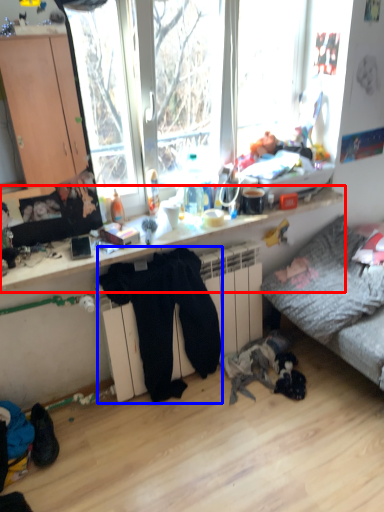
Question: Which of the following is the closest to the observer, desk (highlighted by a red box) or clothing (highlighted by a blue box)?

Choices:
 (A) desk
 (B) clothing

Answer: (A)